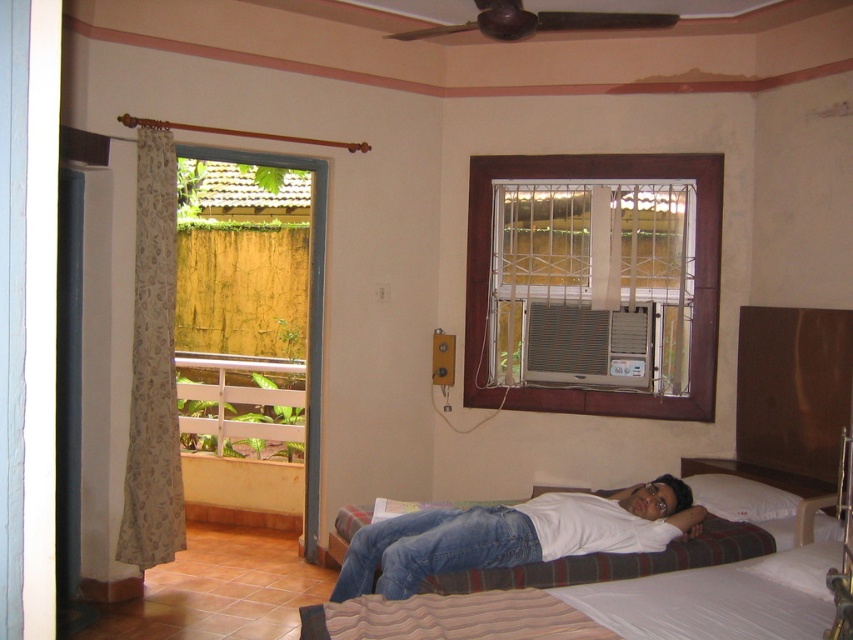
You are a nurse checking on a patient in a hospital room. You see the white fabric hospital bed at center and the white matte shirt at center. Which object is more to the right?

The white fabric hospital bed at center is positioned on the right side of the white matte shirt at center, so the white fabric hospital bed at center is more to the right.

From the picture: You are a nurse checking on a patient in a hospital room. You see the white fabric hospital bed at center and the white matte shirt at center. Which object is taller?

The white matte shirt at center is taller than the white fabric hospital bed at center.